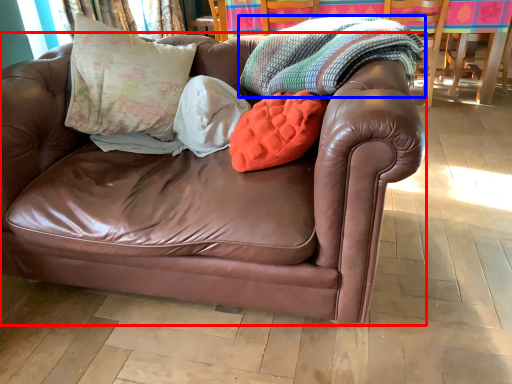
Question: Which of the following is the closest to the observer, studio couch (highlighted by a red box) or blanket (highlighted by a blue box)?

Choices:
 (A) studio couch
 (B) blanket

Answer: (A)